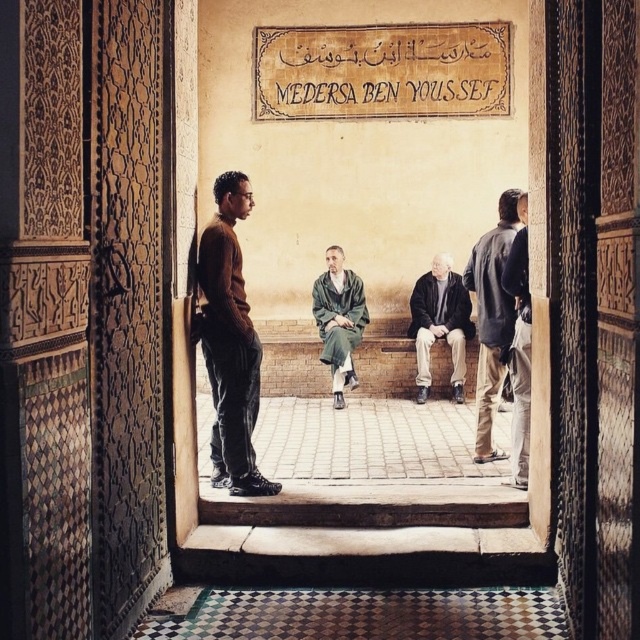
Between green textured robe at center and dark brown leather jacket at right, which one appears on the left side from the viewer's perspective?

Positioned to the left is green textured robe at center.

Can you confirm if green textured robe at center is smaller than dark brown leather jacket at right?

No.

Find the location of a particular element. This screenshot has width=640, height=640. green textured robe at center is located at coordinates (339, 320).

Where is `green textured robe at center`? The image size is (640, 640). green textured robe at center is located at coordinates (339, 320).

Which is more to the left, dark gray jacket at right or dark brown leather jacket at center?

Positioned to the left is dark brown leather jacket at center.

This screenshot has width=640, height=640. What do you see at coordinates (492, 317) in the screenshot? I see `dark gray jacket at right` at bounding box center [492, 317].

What are the coordinates of `dark gray jacket at right` in the screenshot? It's located at (492, 317).

Can you confirm if brown sweater at center is wider than dark gray jacket at right?

Yes, brown sweater at center is wider than dark gray jacket at right.

Between brown sweater at center and dark gray jacket at right, which one is positioned lower?

brown sweater at center is below.

Is point (250, 404) closer to camera compared to point (474, 289)?

Yes, it is.

Where is `brown sweater at center`? The image size is (640, 640). brown sweater at center is located at coordinates (228, 342).